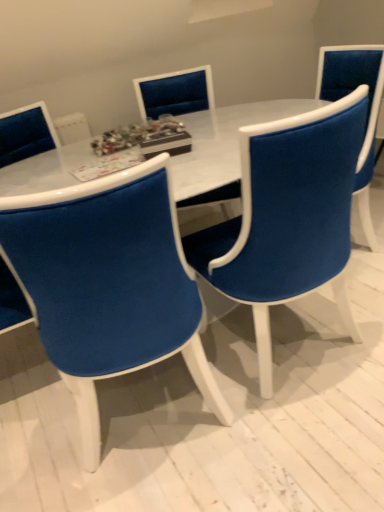
The image size is (384, 512). In order to click on space that is in front of velvet blue chair at center, placed as the 2th chair when sorted from back to front in this screenshot , I will do `click(300, 443)`.